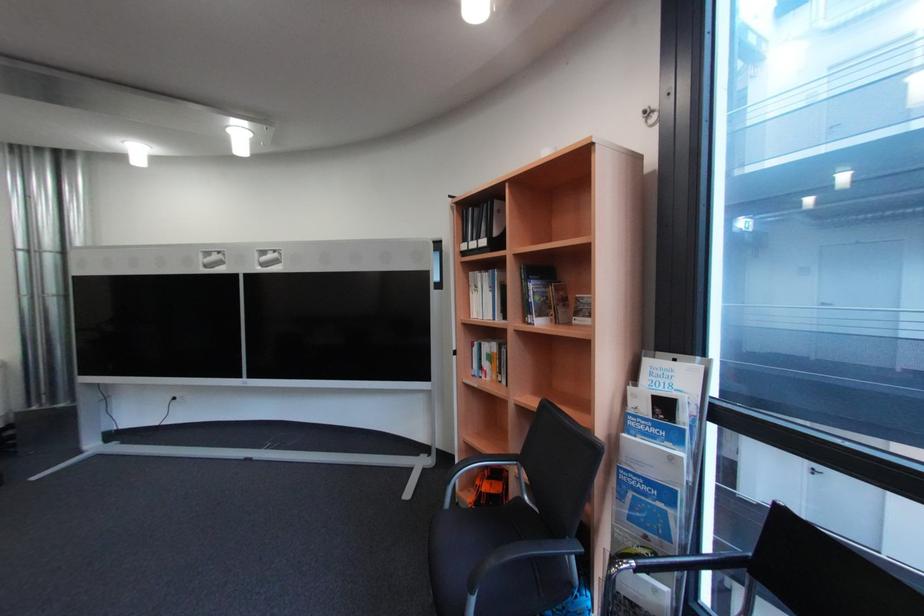
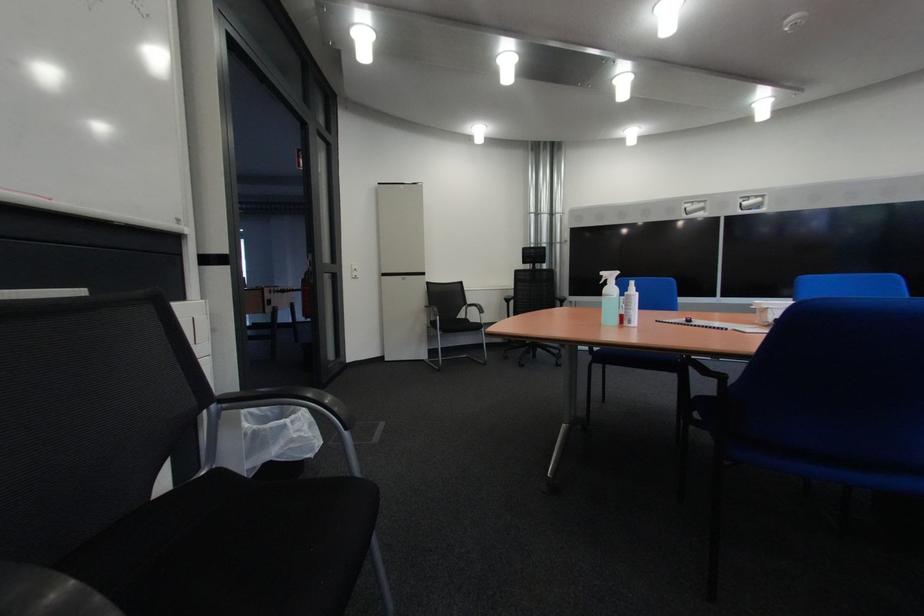
Which direction would the cameraman need to move to produce the second image?

The cameraman moved toward left, backward.